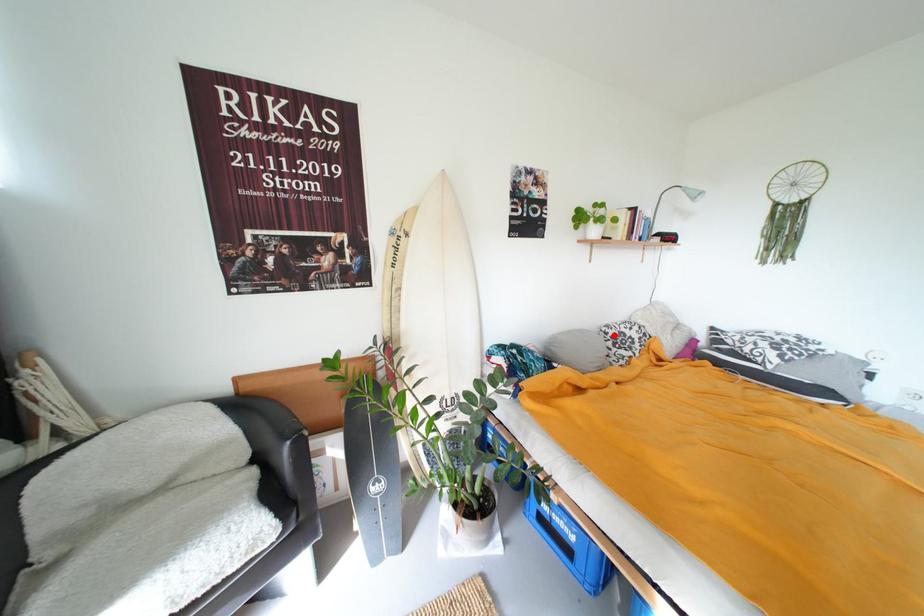
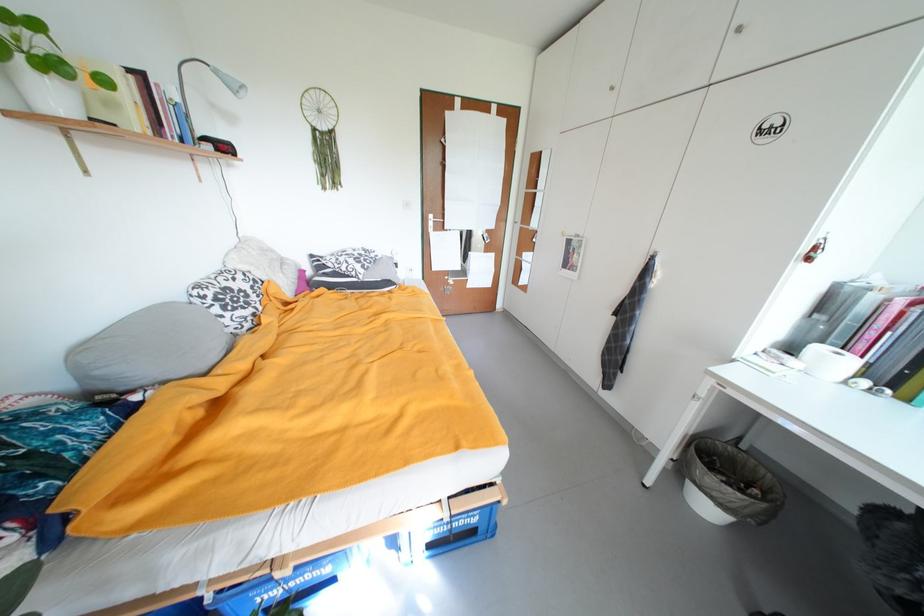
Locate, in the second image, the point that corresponds to the highlighted location in the first image.

(211, 299)